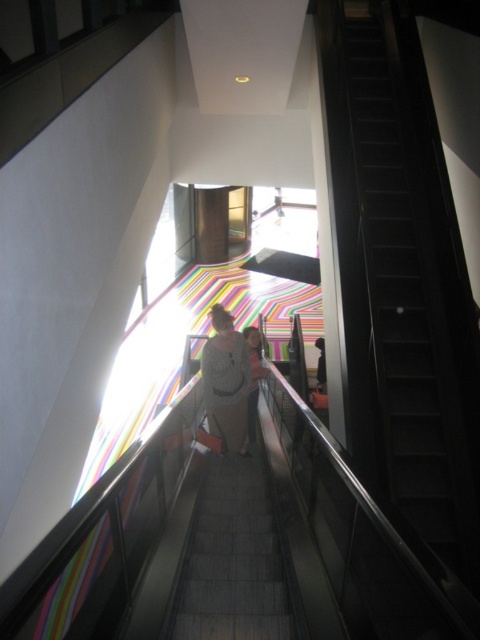
Question: Where is dark gray concrete stairs at center located in relation to white textured shirt at center in the image?

Choices:
 (A) left
 (B) right

Answer: (B)

Question: From the image, what is the correct spatial relationship of black metal stairs at upper right in relation to dark gray concrete stairs at center?

Choices:
 (A) right
 (B) left

Answer: (A)

Question: Which object is farther from the camera taking this photo?

Choices:
 (A) dark gray concrete stairs at center
 (B) white textured shirt at center
 (C) black metal stairs at upper right
 (D) white cotton shirt at center

Answer: (D)

Question: Does dark gray concrete stairs at center have a greater width compared to white textured shirt at center?

Choices:
 (A) yes
 (B) no

Answer: (A)

Question: Which is farther from the black metal stairs at upper right?

Choices:
 (A) white cotton shirt at center
 (B) dark gray concrete stairs at center
 (C) white textured shirt at center

Answer: (A)

Question: Which point is closer to the camera?

Choices:
 (A) (228, 573)
 (B) (265, 369)
 (C) (462, 253)
 (D) (228, 380)

Answer: (A)